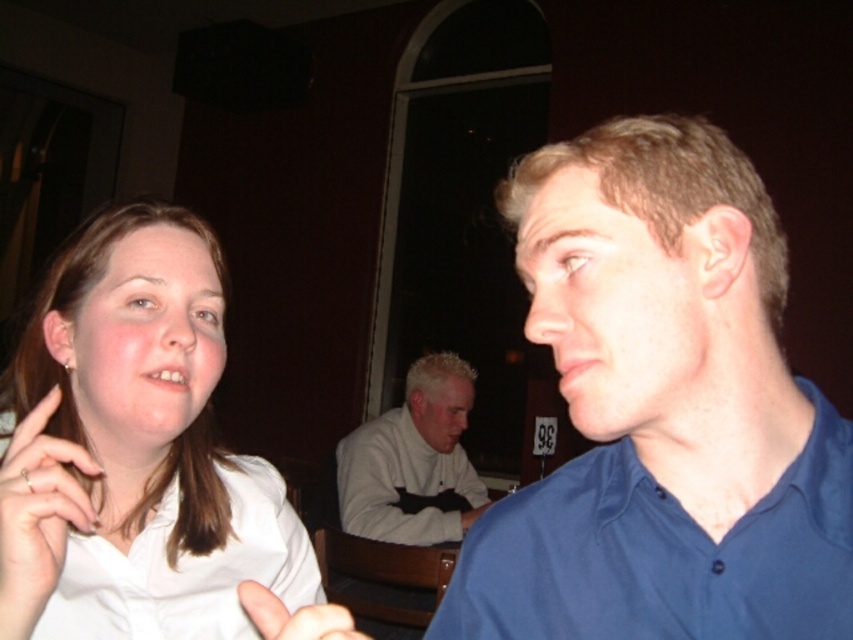
Question: Where is blue cotton shirt at right located in relation to white matte hand at lower left in the image?

Choices:
 (A) above
 (B) below

Answer: (A)

Question: Considering the real-world distances, which object is closest to the white matte ring at lower left?

Choices:
 (A) blue cotton shirt at right
 (B) white matte shirt at left
 (C) white matte hand at lower left
 (D) white sweater at center

Answer: (B)

Question: Which of these objects is positioned closest to the blue cotton shirt at right?

Choices:
 (A) white matte hand at lower left
 (B) white sweater at center

Answer: (A)

Question: Can you confirm if blue cotton shirt at right is thinner than white matte ring at lower left?

Choices:
 (A) yes
 (B) no

Answer: (B)

Question: Which of the following is the farthest from the observer?

Choices:
 (A) white matte ring at lower left
 (B) white sweater at center
 (C) white matte hand at lower left

Answer: (B)

Question: Is blue cotton shirt at right further to camera compared to white matte ring at lower left?

Choices:
 (A) yes
 (B) no

Answer: (A)